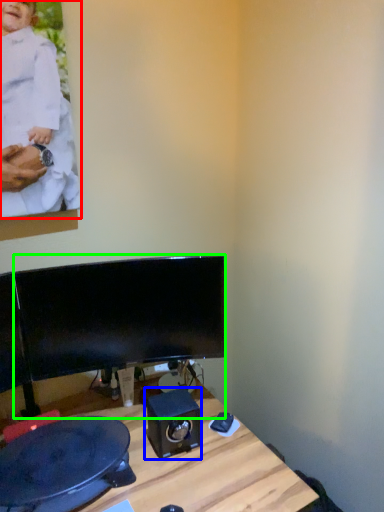
Question: Based on their relative distances, which object is nearer to person (highlighted by a red box)? Choose from speaker (highlighted by a blue box) and computer monitor (highlighted by a green box).

Choices:
 (A) speaker
 (B) computer monitor

Answer: (B)